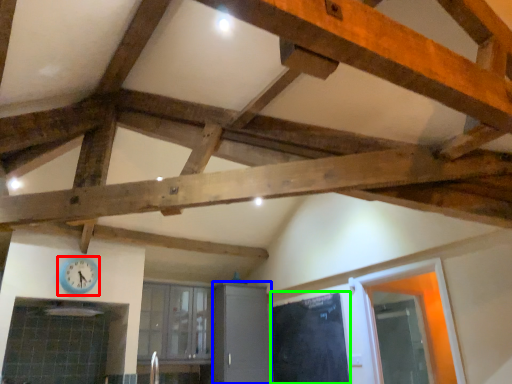
Question: Based on their relative distances, which object is nearer to clock (highlighted by a red box)? Choose from cabinetry (highlighted by a blue box) and door (highlighted by a green box).

Choices:
 (A) cabinetry
 (B) door

Answer: (A)